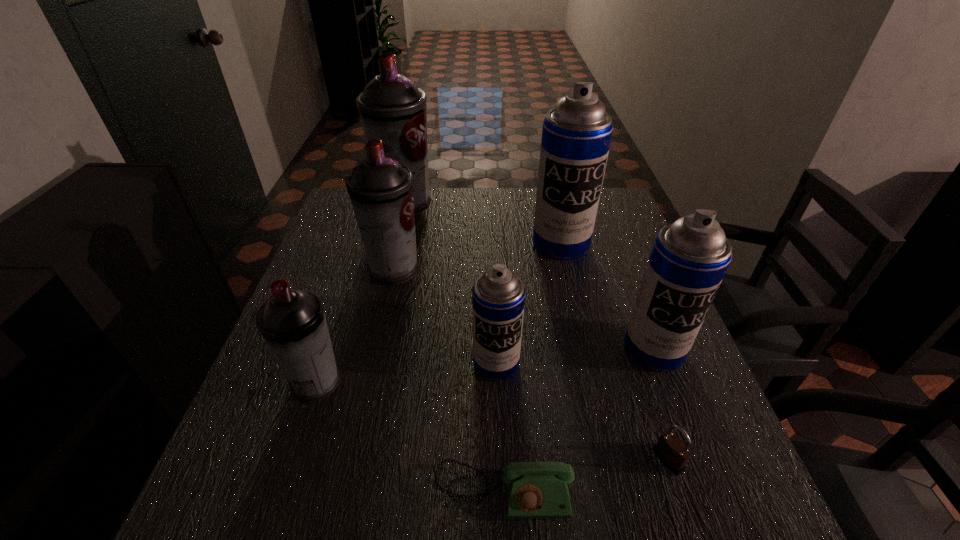
In order to click on the farthest gray aerosol can in this screenshot , I will do `click(392, 109)`.

The image size is (960, 540). Find the location of `the farthest aerosol can`. the farthest aerosol can is located at coordinates (392, 109).

The width and height of the screenshot is (960, 540). I want to click on the biggest blue aerosol can, so click(x=576, y=135).

The width and height of the screenshot is (960, 540). In order to click on the second blue aerosol can from left to right in this screenshot , I will do `click(576, 135)`.

The width and height of the screenshot is (960, 540). Find the location of `the second nearest gray aerosol can`. the second nearest gray aerosol can is located at coordinates (381, 189).

You are a GUI agent. You are given a task and a screenshot of the screen. Output one action in this format:
    pyautogui.click(x=<x>, y=<y>)
    Task: Click on the second biggest blue aerosol can
    
    Given the screenshot: What is the action you would take?
    pyautogui.click(x=689, y=258)

The image size is (960, 540). Identify the location of the rightmost aerosol can. (689, 258).

Locate an element on the screen. the leftmost blue aerosol can is located at coordinates (498, 296).

At what (x,y) coordinates should I click in order to perform the action: click on the smallest blue aerosol can. Please return your answer as a coordinate pair (x, y). Looking at the image, I should click on (498, 296).

This screenshot has height=540, width=960. Identify the location of the nearest gray aerosol can. (292, 322).